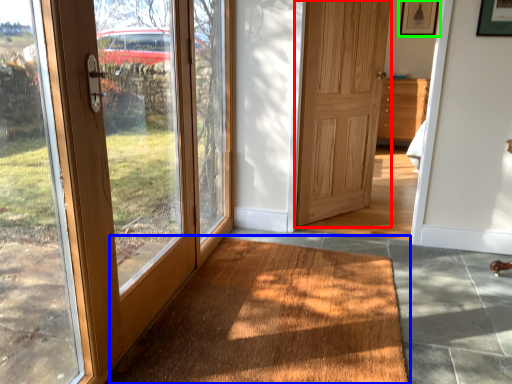
Question: Which object is the closest to the door (highlighted by a red box)? Choose among these: doormat (highlighted by a blue box) or picture frame (highlighted by a green box).

Choices:
 (A) doormat
 (B) picture frame

Answer: (B)